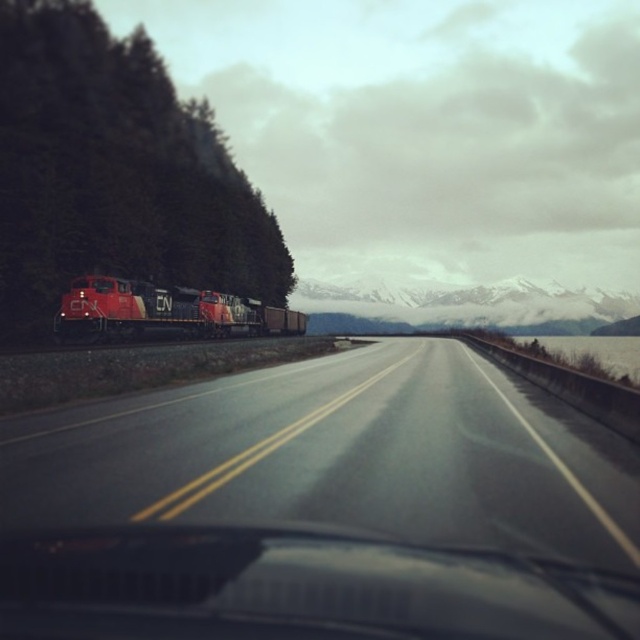
You are a GUI agent. You are given a task and a screenshot of the screen. Output one action in this format:
    pyautogui.click(x=<x>, y=<y>)
    Task: Click on the green matte tree at left
    This screenshot has height=640, width=640.
    Given the screenshot: What is the action you would take?
    pyautogui.click(x=115, y=172)

Can you confirm if green matte tree at left is shorter than transparent glass windshield at center?

No.

The width and height of the screenshot is (640, 640). Describe the element at coordinates (115, 172) in the screenshot. I see `green matte tree at left` at that location.

Locate an element on the screen. This screenshot has height=640, width=640. green matte tree at left is located at coordinates (115, 172).

Between black asphalt highway at center and transparent glass windshield at center, which one is positioned higher?

Positioned higher is transparent glass windshield at center.

Who is positioned more to the left, black asphalt highway at center or transparent glass windshield at center?

black asphalt highway at center

You are a GUI agent. You are given a task and a screenshot of the screen. Output one action in this format:
    pyautogui.click(x=<x>, y=<y>)
    Task: Click on the black asphalt highway at center
    This screenshot has height=640, width=640.
    Given the screenshot: What is the action you would take?
    pyautogui.click(x=339, y=456)

Locate an element on the screen. This screenshot has height=640, width=640. black asphalt highway at center is located at coordinates (339, 456).

Which of these two, black asphalt highway at center or snowy mountain at upper center, stands shorter?

With less height is black asphalt highway at center.

Is black asphalt highway at center bigger than snowy mountain at upper center?

Incorrect, black asphalt highway at center is not larger than snowy mountain at upper center.

Who is more forward, (531, 433) or (531, 298)?

Point (531, 433) is in front.

At what (x,y) coordinates should I click in order to perform the action: click on black asphalt highway at center. Please return your answer as a coordinate pair (x, y). Looking at the image, I should click on (339, 456).